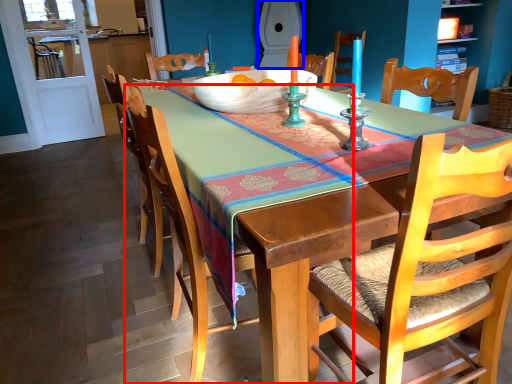
Question: Which object appears closest to the camera in this image, chair (highlighted by a red box) or toilet (highlighted by a blue box)?

Choices:
 (A) chair
 (B) toilet

Answer: (A)